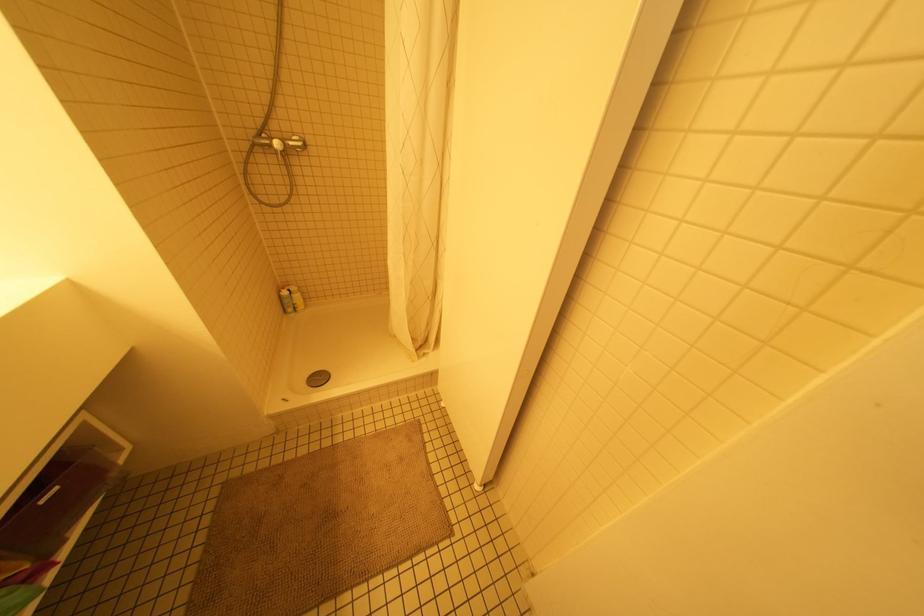
Find the location of a particular element. silver faucet lever is located at coordinates (278, 148).